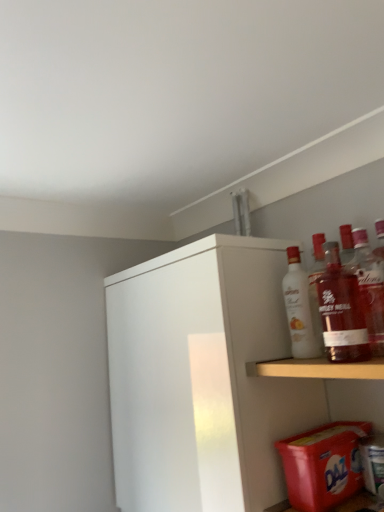
Image resolution: width=384 pixels, height=512 pixels. Describe the element at coordinates (301, 309) in the screenshot. I see `white glossy bottle at upper right, positioned as the 1th bottle in left-to-right order` at that location.

Where is `white glossy bottle at upper right, positioned as the 1th bottle in left-to-right order`? The image size is (384, 512). white glossy bottle at upper right, positioned as the 1th bottle in left-to-right order is located at coordinates (x=301, y=309).

Describe the element at coordinates (369, 288) in the screenshot. The width and height of the screenshot is (384, 512). I see `translucent glass bottle at upper right, the second bottle viewed from the left` at that location.

The height and width of the screenshot is (512, 384). What are the coordinates of `white glossy bottle at upper right, placed as the 2th bottle when sorted from right to left` in the screenshot? It's located at (301, 309).

Does white glossy bottle at upper right, positioned as the 1th bottle in left-to-right order, have a lesser height compared to white matte cabinet at upper right?

Yes.

Considering the relative positions of white glossy bottle at upper right, placed as the 2th bottle when sorted from right to left, and white matte cabinet at upper right in the image provided, is white glossy bottle at upper right, placed as the 2th bottle when sorted from right to left, behind white matte cabinet at upper right?

Yes.

Can you tell me how much white glossy bottle at upper right, which is the 2th bottle from front to back, and white matte cabinet at upper right differ in facing direction?

The angle between the facing direction of white glossy bottle at upper right, which is the 2th bottle from front to back, and the facing direction of white matte cabinet at upper right is 1.26 degrees.

Does white glossy bottle at upper right, positioned as the 1th bottle in left-to-right order, contain white matte cabinet at upper right?

No, white matte cabinet at upper right is not inside white glossy bottle at upper right, positioned as the 1th bottle in left-to-right order.

Which is nearer, [345,304] or [300,506]?

Point [345,304].

From a real-world perspective, is translucent glass bottle at shelf right physically located above or below red plastic laundry detergent at lower right?

Clearly, from a real-world perspective, translucent glass bottle at shelf right is above red plastic laundry detergent at lower right.

Could you tell me if translucent glass bottle at shelf right is turned towards red plastic laundry detergent at lower right?

No, translucent glass bottle at shelf right is not aimed at red plastic laundry detergent at lower right.

From the image's perspective, is translucent glass bottle at shelf right beneath red plastic laundry detergent at lower right?

No, from the image's perspective, translucent glass bottle at shelf right is not beneath red plastic laundry detergent at lower right.

Does translucent glass bottle at shelf right lie in front of white glossy bottle at upper right, which appears as the 1th bottle when viewed from the back?

Yes.

Between point (329, 294) and point (294, 301), which one is positioned in front?

The point (329, 294) is more forward.

Is white glossy bottle at upper right, placed as the 2th bottle when sorted from right to left, at the back of translucent glass bottle at shelf right?

No, translucent glass bottle at shelf right's orientation is not away from white glossy bottle at upper right, placed as the 2th bottle when sorted from right to left.

Is translucent glass bottle at shelf right not inside white glossy bottle at upper right, placed as the 2th bottle when sorted from right to left?

translucent glass bottle at shelf right is positioned outside white glossy bottle at upper right, placed as the 2th bottle when sorted from right to left.

Could you tell me if red plastic laundry detergent at lower right is turned towards white glossy bottle at upper right, placed as the 2th bottle when sorted from right to left?

No.

From a real-world perspective, is red plastic laundry detergent at lower right on white glossy bottle at upper right, placed as the 2th bottle when sorted from right to left?

No, from a real-world perspective, red plastic laundry detergent at lower right is not above white glossy bottle at upper right, placed as the 2th bottle when sorted from right to left.

Considering the positions of objects red plastic laundry detergent at lower right and white glossy bottle at upper right, placed as the 2th bottle when sorted from right to left, in the image provided, who is behind, red plastic laundry detergent at lower right or white glossy bottle at upper right, placed as the 2th bottle when sorted from right to left,?

white glossy bottle at upper right, placed as the 2th bottle when sorted from right to left, is behind.

Which is more to the left, white glossy bottle at upper right, positioned as the 1th bottle in left-to-right order, or translucent glass bottle at shelf right?

white glossy bottle at upper right, positioned as the 1th bottle in left-to-right order, is more to the left.

From the image's perspective, between white glossy bottle at upper right, placed as the 2th bottle when sorted from right to left, and translucent glass bottle at shelf right, who is located below?

From the image's view, white glossy bottle at upper right, placed as the 2th bottle when sorted from right to left, is below.

From a real-world perspective, is white glossy bottle at upper right, which appears as the 1th bottle when viewed from the back, on translucent glass bottle at shelf right?

Yes, from a real-world perspective, white glossy bottle at upper right, which appears as the 1th bottle when viewed from the back, is on top of translucent glass bottle at shelf right.

From the image's perspective, is red plastic laundry detergent at lower right located above or below white matte cabinet at upper right?

red plastic laundry detergent at lower right is situated lower than white matte cabinet at upper right in the image.

Does red plastic laundry detergent at lower right lie in front of white matte cabinet at upper right?

Yes, the depth of red plastic laundry detergent at lower right is less than that of white matte cabinet at upper right.

Is red plastic laundry detergent at lower right wider than white matte cabinet at upper right?

No.

Is red plastic laundry detergent at lower right bigger or smaller than white matte cabinet at upper right?

In the image, red plastic laundry detergent at lower right appears to be smaller than white matte cabinet at upper right.

The width and height of the screenshot is (384, 512). What are the coordinates of `bottle in front of the white glossy bottle at upper right, placed as the 2th bottle when sorted from right to left` in the screenshot? It's located at (369, 288).

Is white glossy bottle at upper right, which appears as the 1th bottle when viewed from the back, at the back of translucent glass bottle at upper right, marked as the first bottle in a front-to-back arrangement?

No, translucent glass bottle at upper right, marked as the first bottle in a front-to-back arrangement, is not facing the opposite direction of white glossy bottle at upper right, which appears as the 1th bottle when viewed from the back.

Is translucent glass bottle at upper right, the second bottle viewed from the left, to the left of white glossy bottle at upper right, which appears as the 1th bottle when viewed from the back, from the viewer's perspective?

Incorrect, translucent glass bottle at upper right, the second bottle viewed from the left, is not on the left side of white glossy bottle at upper right, which appears as the 1th bottle when viewed from the back.

Considering the positions of point (383, 332) and point (295, 315), is point (383, 332) closer or farther from the camera than point (295, 315)?

Point (383, 332).

Where is `cabinetry in front of the white glossy bottle at upper right, positioned as the 1th bottle in left-to-right order`? This screenshot has height=512, width=384. cabinetry in front of the white glossy bottle at upper right, positioned as the 1th bottle in left-to-right order is located at coordinates (199, 377).

The height and width of the screenshot is (512, 384). I want to click on carton lying on the right of translucent glass bottle at shelf right, so click(323, 464).

Estimate the real-world distances between objects in this image. Which object is further from white glossy bottle at upper right, positioned as the 1th bottle in left-to-right order, red plastic laundry detergent at lower right or translucent glass bottle at shelf right?

Based on the image, red plastic laundry detergent at lower right appears to be further to white glossy bottle at upper right, positioned as the 1th bottle in left-to-right order.

Based on their spatial positions, is translucent glass bottle at shelf right or white glossy bottle at upper right, which is the 2th bottle from front to back, further from white matte cabinet at upper right?

The object further to white matte cabinet at upper right is translucent glass bottle at shelf right.

From the image, which object appears to be farther from translucent glass bottle at shelf right, translucent glass bottle at upper right, the second bottle viewed from the left, or red plastic laundry detergent at lower right?

red plastic laundry detergent at lower right lies further to translucent glass bottle at shelf right than the other object.

When comparing their distances from translucent glass bottle at shelf right, does translucent glass bottle at upper right, the 1th bottle in the right-to-left sequence, or white glossy bottle at upper right, which is the 2th bottle from front to back, seem closer?

Based on the image, translucent glass bottle at upper right, the 1th bottle in the right-to-left sequence, appears to be nearer to translucent glass bottle at shelf right.

From the image, which object appears to be nearer to red plastic laundry detergent at lower right, white glossy bottle at upper right, which is the 2th bottle from front to back, or white matte cabinet at upper right?

white glossy bottle at upper right, which is the 2th bottle from front to back.

Looking at the image, which one is located closer to translucent glass bottle at upper right, the second bottle viewed from the left, white glossy bottle at upper right, positioned as the 1th bottle in left-to-right order, or red plastic laundry detergent at lower right?

white glossy bottle at upper right, positioned as the 1th bottle in left-to-right order, lies closer to translucent glass bottle at upper right, the second bottle viewed from the left, than the other object.

Looking at the image, which one is located further to translucent glass bottle at upper right, which is the second bottle from back to front, white matte cabinet at upper right or white glossy bottle at upper right, which appears as the 1th bottle when viewed from the back?

white matte cabinet at upper right is further to translucent glass bottle at upper right, which is the second bottle from back to front.

Which object lies nearer to the anchor point white glossy bottle at upper right, which appears as the 1th bottle when viewed from the back, translucent glass bottle at shelf right or red plastic laundry detergent at lower right?

Among the two, translucent glass bottle at shelf right is located nearer to white glossy bottle at upper right, which appears as the 1th bottle when viewed from the back.

Locate an element on the screen. The width and height of the screenshot is (384, 512). bottle between white matte cabinet at upper right and translucent glass bottle at upper right, which is the second bottle from back to front, in the horizontal direction is located at coordinates (301, 309).

At what (x,y) coordinates should I click in order to perform the action: click on cabinetry that lies between translucent glass bottle at upper right, which is the second bottle from back to front, and red plastic laundry detergent at lower right from top to bottom. Please return your answer as a coordinate pair (x, y). Looking at the image, I should click on (199, 377).

Find the location of a particular element. This screenshot has height=512, width=384. bottle between translucent glass bottle at shelf right and white matte cabinet at upper right vertically is located at coordinates (301, 309).

The height and width of the screenshot is (512, 384). I want to click on cabinetry that lies between white glossy bottle at upper right, which appears as the 1th bottle when viewed from the back, and red plastic laundry detergent at lower right from top to bottom, so click(x=199, y=377).